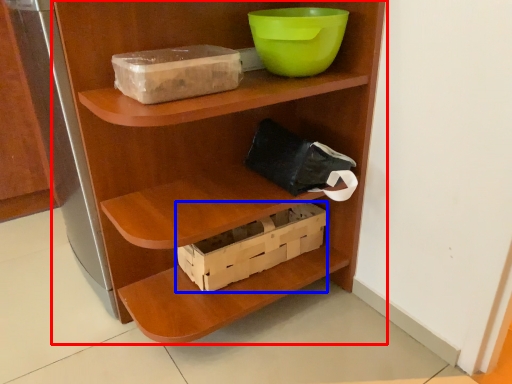
Question: Which of the following is the farthest to the observer, shelf (highlighted by a red box) or box (highlighted by a blue box)?

Choices:
 (A) shelf
 (B) box

Answer: (B)